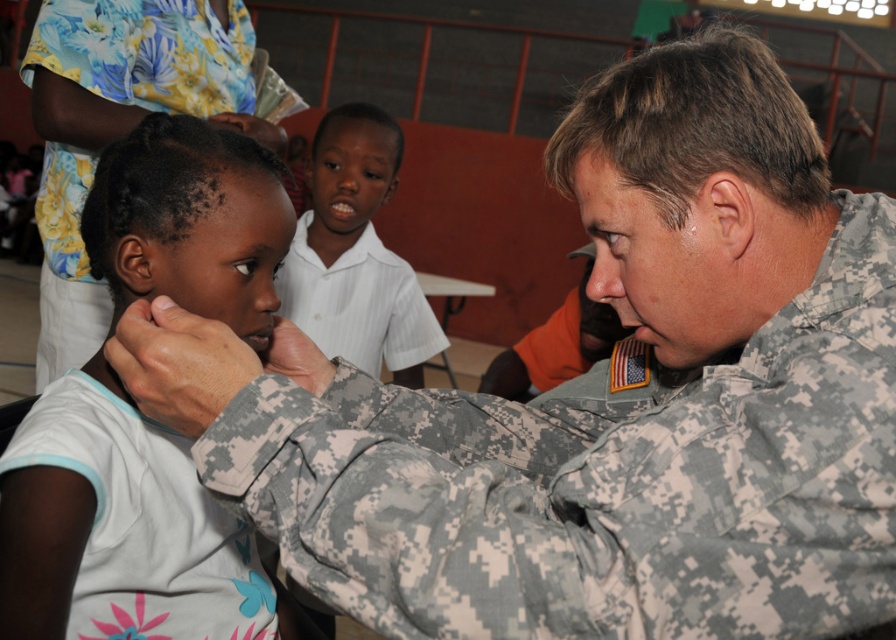
Question: Is white matte shirt at center to the left of camouflage fabric at center from the viewer's perspective?

Choices:
 (A) no
 (B) yes

Answer: (A)

Question: From the image, what is the correct spatial relationship of white matte shirt at center in relation to white striped shirt at center?

Choices:
 (A) right
 (B) left

Answer: (A)

Question: Which of the following is the closest to the observer?

Choices:
 (A) white striped shirt at center
 (B) white matte shirt at center
 (C) camouflage fabric at center

Answer: (B)

Question: Which point is farther from the camera taking this photo?

Choices:
 (A) (26, 420)
 (B) (101, 538)

Answer: (A)

Question: Observing the image, what is the correct spatial positioning of white matte shirt at center in reference to camouflage fabric at center?

Choices:
 (A) above
 (B) below

Answer: (A)

Question: Which of the following is the farthest from the observer?

Choices:
 (A) white striped shirt at center
 (B) white matte shirt at center
 (C) camouflage fabric at center

Answer: (A)